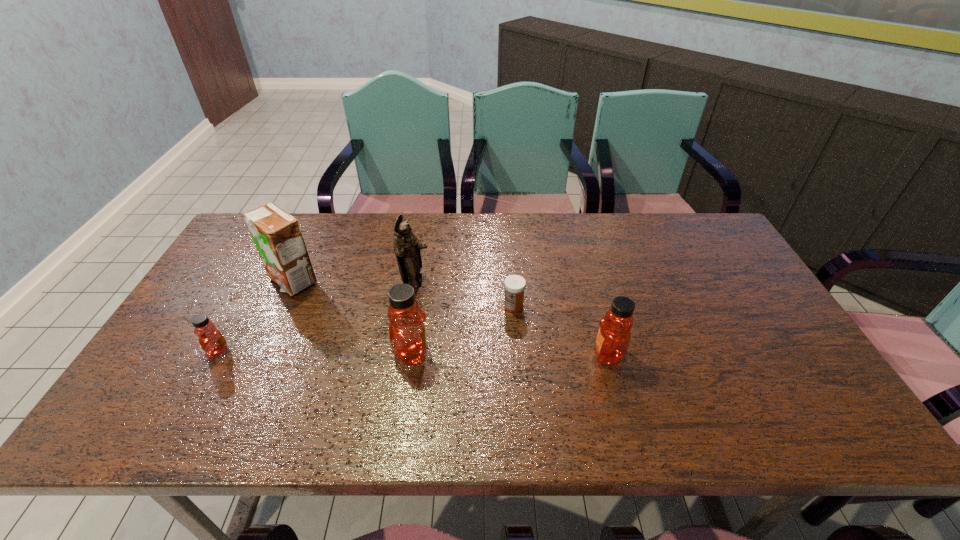
Find the location of `vacant space that satisfies the following two spatial constraints: 1. on the back side of the medicine; 2. on the front-facing side of the figurine`. vacant space that satisfies the following two spatial constraints: 1. on the back side of the medicine; 2. on the front-facing side of the figurine is located at coordinates (512, 282).